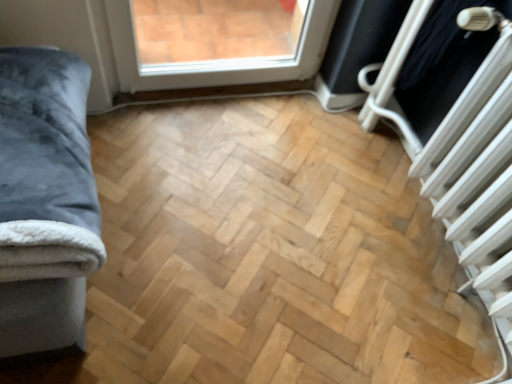
You are a GUI agent. You are given a task and a screenshot of the screen. Output one action in this format:
    pyautogui.click(x=<x>, y=<y>)
    Task: Click on the free space below white metallic radiator at right (from a real-world perspective)
    
    Given the screenshot: What is the action you would take?
    pyautogui.click(x=436, y=251)